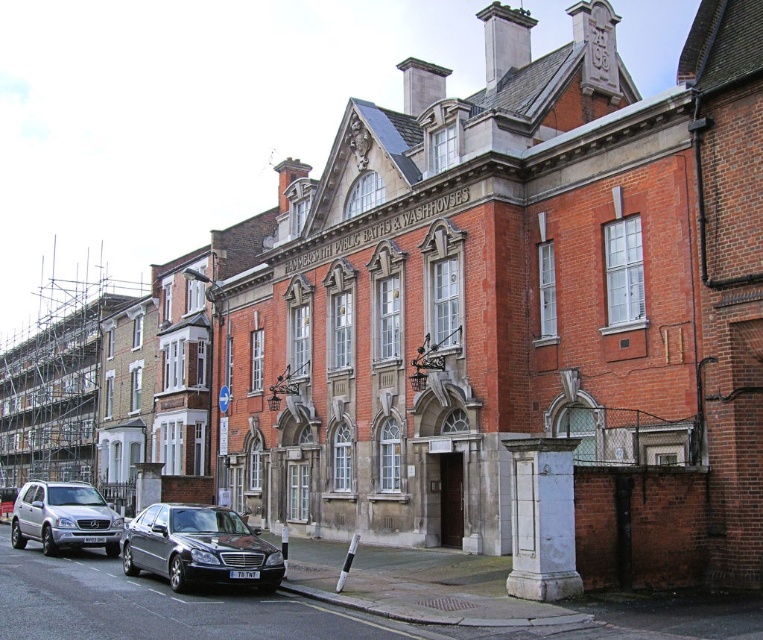
Question: Considering the real-world distances, which object is closest to the silver metallic suv at lower left?

Choices:
 (A) shiny black sedan at lower center
 (B) metal scaffolding at left

Answer: (A)

Question: Which of the following is the closest to the observer?

Choices:
 (A) silver metallic suv at lower left
 (B) metal scaffolding at left

Answer: (A)

Question: Does metal scaffolding at left come behind silver metallic suv at lower left?

Choices:
 (A) no
 (B) yes

Answer: (B)

Question: Does metal scaffolding at left have a lesser width compared to shiny black sedan at lower center?

Choices:
 (A) no
 (B) yes

Answer: (A)

Question: Among these objects, which one is nearest to the camera?

Choices:
 (A) silver metallic suv at lower left
 (B) shiny black sedan at lower center
 (C) metal scaffolding at left

Answer: (B)

Question: In this image, where is shiny black sedan at lower center located relative to silver metallic suv at lower left?

Choices:
 (A) right
 (B) left

Answer: (A)